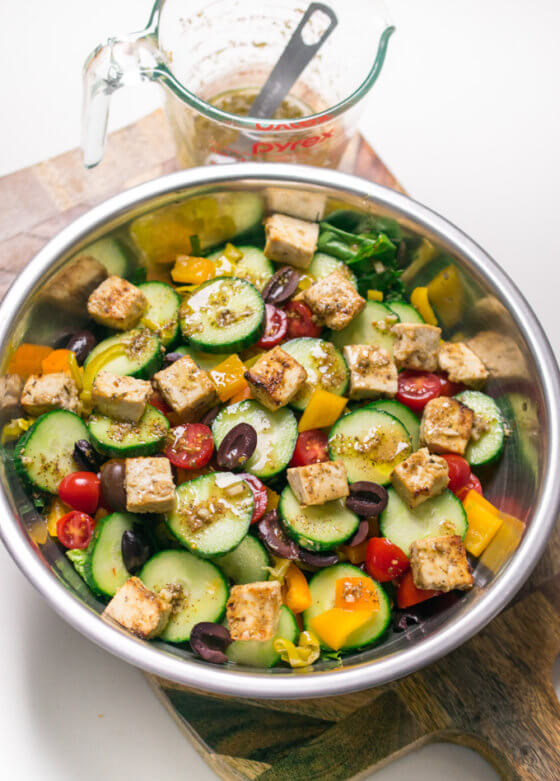
You are a GUI agent. You are given a task and a screenshot of the screen. Output one action in this format:
    pyautogui.click(x=<x>, y=<y>)
    Task: Click on the pyrex container
    
    Given the screenshot: What is the action you would take?
    pyautogui.click(x=232, y=123)